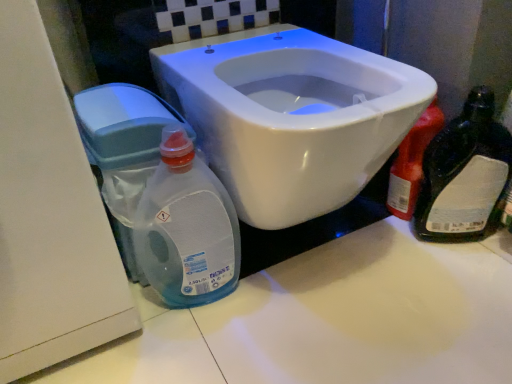
Question: Would you say white glossy toilet at center is inside or outside translucent plastic bottle at right?

Choices:
 (A) inside
 (B) outside

Answer: (B)

Question: Relative to translucent plastic bottle at right, is white glossy toilet at center in front or behind?

Choices:
 (A) front
 (B) behind

Answer: (A)

Question: Based on their relative distances, which object is nearer to the translucent plastic bottle at right?

Choices:
 (A) transparent plastic water tank at lower left
 (B) translucent plastic bottle at right
 (C) transparent plastic bottle at lower left
 (D) white glossy toilet at center

Answer: (B)

Question: Which object is the closest to the translucent plastic bottle at right?

Choices:
 (A) transparent plastic water tank at lower left
 (B) translucent plastic bottle at right
 (C) white glossy toilet at center
 (D) transparent plastic bottle at lower left

Answer: (B)